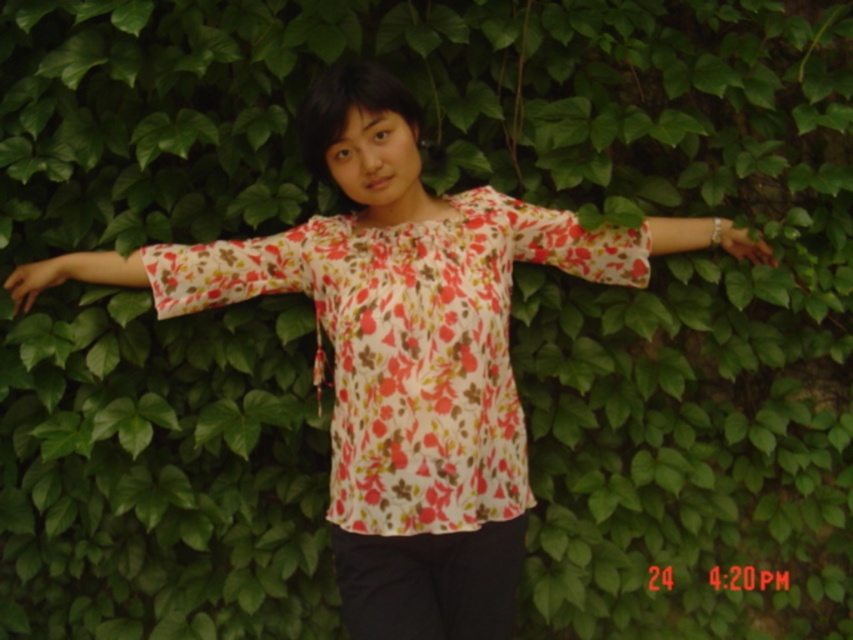
Is floral fabric arm at left shorter than floral fabric arm at center?

In fact, floral fabric arm at left may be taller than floral fabric arm at center.

Does floral fabric arm at left appear under floral fabric arm at center?

Correct, floral fabric arm at left is located below floral fabric arm at center.

Measure the distance between point (88, 260) and camera.

They are 6.59 feet apart.

This screenshot has width=853, height=640. I want to click on floral fabric arm at left, so click(x=180, y=272).

Between floral fabric arm at center and matte floral blouse at center, which one appears on the right side from the viewer's perspective?

matte floral blouse at center

Does floral fabric arm at center come in front of matte floral blouse at center?

Yes, floral fabric arm at center is closer to the viewer.

This screenshot has height=640, width=853. Find the location of `floral fabric arm at center`. floral fabric arm at center is located at coordinates (627, 243).

This screenshot has height=640, width=853. Identify the location of floral fabric arm at center. (627, 243).

Is matte floral shirt at left to the left of matte floral blouse at center from the viewer's perspective?

Correct, you'll find matte floral shirt at left to the left of matte floral blouse at center.

Does matte floral shirt at left have a greater width compared to matte floral blouse at center?

Yes.

Between point (24, 291) and point (758, 250), which one is positioned behind?

The point (758, 250) is behind.

This screenshot has width=853, height=640. Identify the location of matte floral shirt at left. (33, 280).